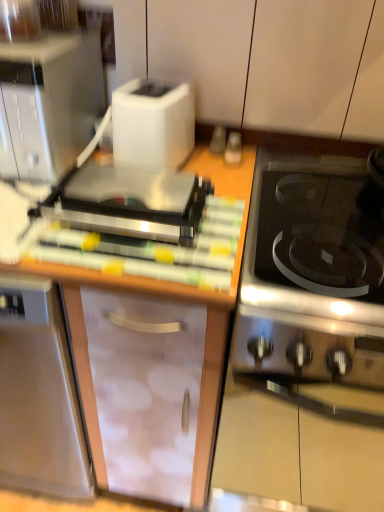
Question: From their relative heights in the image, would you say stainless steel oven at right is taller or shorter than white plastic toaster at upper center?

Choices:
 (A) short
 (B) tall

Answer: (B)

Question: Considering the positions of stainless steel oven at right and white plastic toaster at upper center in the image, is stainless steel oven at right wider or thinner than white plastic toaster at upper center?

Choices:
 (A) wide
 (B) thin

Answer: (A)

Question: Which is nearer to the stainless steel oven at right?

Choices:
 (A) satin silver toaster at upper left
 (B) satin silver microwave at upper left
 (C) transparent plastic cabinet at center, which is the second cabinetry from top to bottom
 (D) black glass cooktop at right
 (E) white matte toaster at upper left, the 1th cabinetry positioned from the top

Answer: (D)

Question: Based on their relative distances, which object is nearer to the white plastic toaster at upper center?

Choices:
 (A) satin silver microwave at upper left
 (B) satin silver toaster at upper left
 (C) white matte toaster at upper left, which appears as the second cabinetry when ordered from the bottom
 (D) wooden cutting board at center
 (E) stainless steel oven at right

Answer: (D)